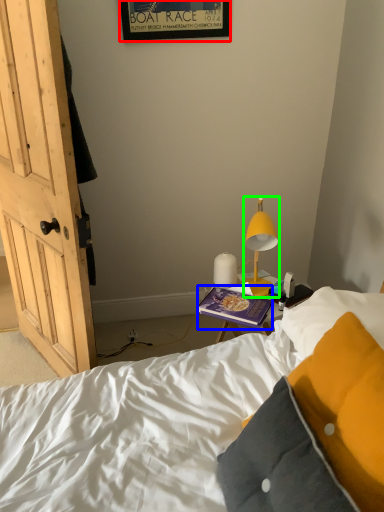
Question: Which is nearer to the picture frame (highlighted by a red box)? book (highlighted by a blue box) or lamp (highlighted by a green box).

Choices:
 (A) book
 (B) lamp

Answer: (B)